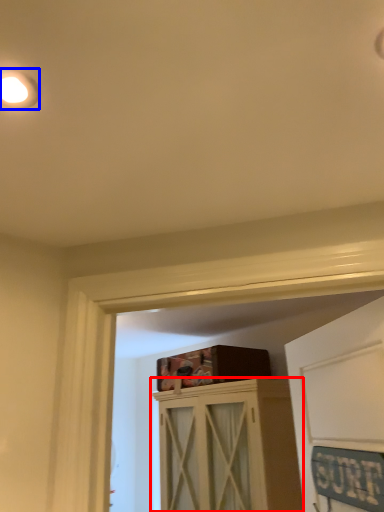
Question: Which point is closer to the camera, cabinetry (highlighted by a red box) or droplight (highlighted by a blue box)?

Choices:
 (A) cabinetry
 (B) droplight

Answer: (B)